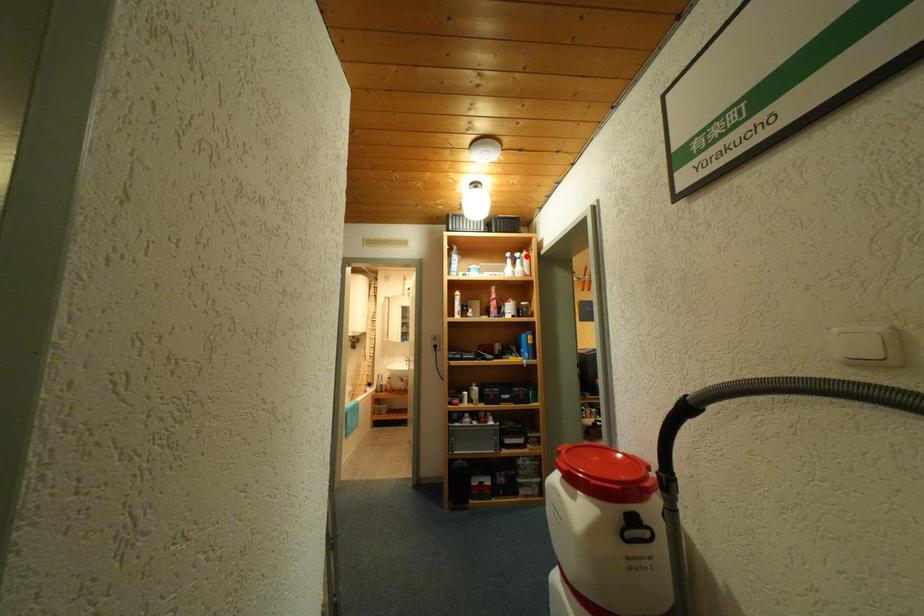
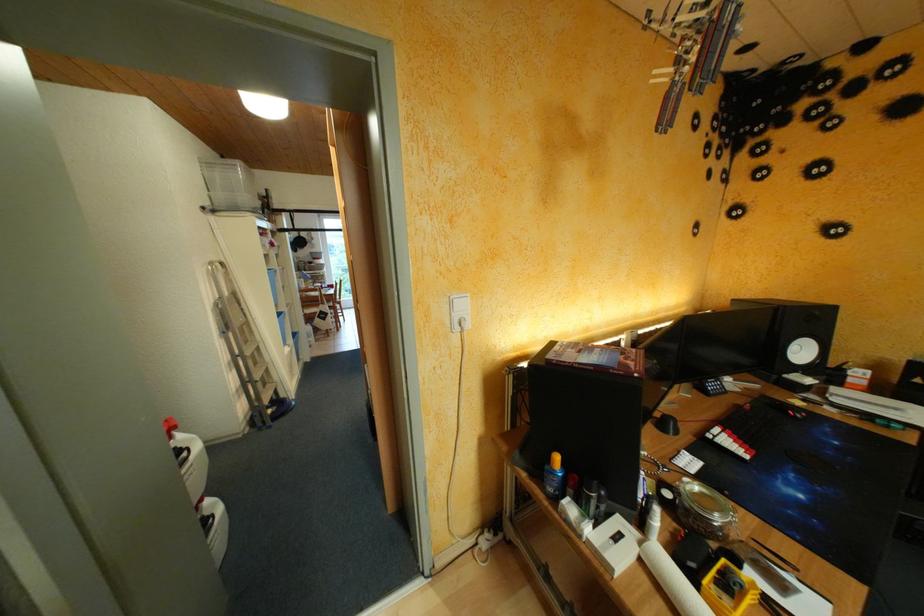
Question: I am providing you with two images of the same scene from different viewpoints. A red point is marked on the first image. At the location where the point appears in image 1, is it still visible in image 2?

Choices:
 (A) Yes
 (B) No

Answer: (B)